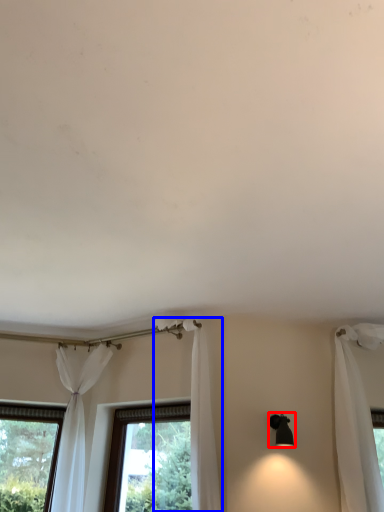
Question: Which object is closer to the camera taking this photo, light fixture (highlighted by a red box) or curtain (highlighted by a blue box)?

Choices:
 (A) light fixture
 (B) curtain

Answer: (B)